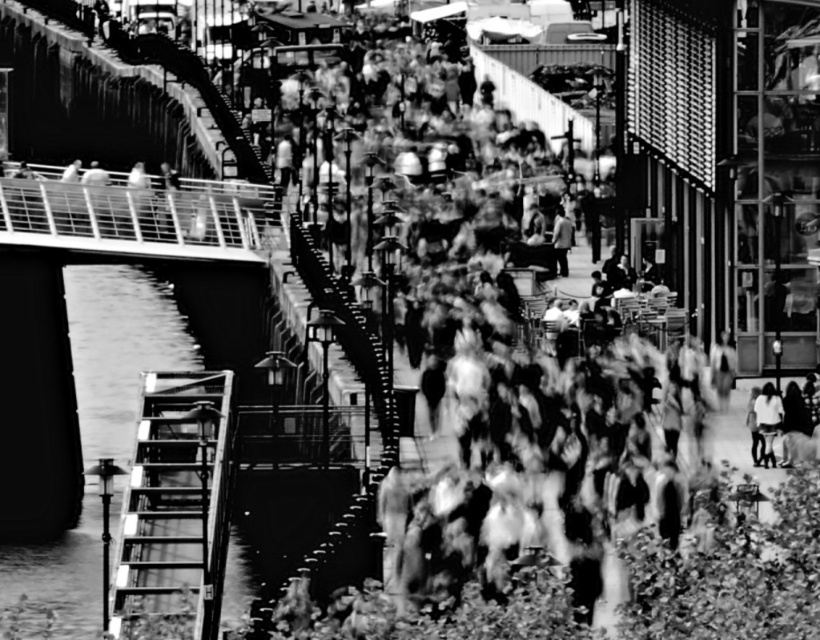
You are a photographer carrying a large camera bag. You need to pass between the metallic ladder at left and the light gray fabric jacket at lower right. Can your bag fit through the space between them?

The metallic ladder at left is wider than the light gray fabric jacket at lower right. Since the ladder is wider, the space between them might be sufficient for your camera bag, but it depends on the exact dimensions of both objects and the bag. However, based on the information provided, the metallic ladder at left has a greater width, so there might be enough space if the bag is narrower than the narrower object.

You are standing at the point marked by the coordinate point (175, 502), which is the location of the metallic ladder at left. Looking towards the bridge with modern design on the left side, can you see the bridge with modern design from your current position?

Yes, because the point (175, 502) marks the metallic ladder at left, which is located on the left side of the image where the bridge with modern design is also situated. Since both are on the left side, the metallic ladder at left would have a clear view of the bridge with modern design.

In the scene shown: You are standing on the riverside promenade and see two points marked in the image. Which point is closer to you, point (137, 472) or point (755, 422)?

Point (137, 472) is in front of point (755, 422), so it is closer to you.